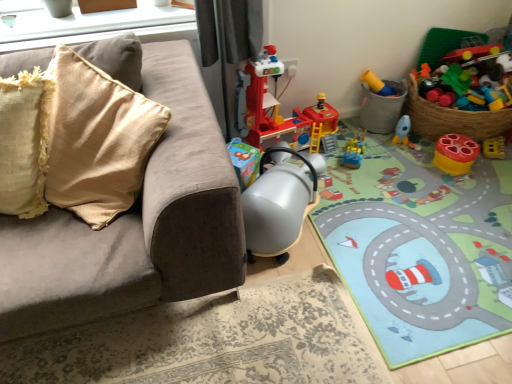
Question: Relative to matte plastic rocket at lower right, the fourth toy positioned from the left, is matte beige couch at left in front or behind?

Choices:
 (A) front
 (B) behind

Answer: (A)

Question: From a real-world perspective, is matte beige couch at left above or below matte plastic rocket at lower right, which appears as the 3th toy when viewed from the right?

Choices:
 (A) above
 (B) below

Answer: (A)

Question: Estimate the real-world distances between objects in this image. Which object is farther from the matte beige couch at left?

Choices:
 (A) translucent plastic toy at upper right, which is the 1th toy from right to left
 (B) matte plastic rocket at lower right, which appears as the 3th toy when viewed from the right
 (C) matte plastic toy at right, the 5th toy in the left-to-right sequence
 (D) carpeted play mat at center
 (E) translucent plastic train at center, positioned as the second toy in left-to-right order

Answer: (A)

Question: Estimate the real-world distances between objects in this image. Which object is farther from the carpeted play mat at center?

Choices:
 (A) matte beige couch at left
 (B) translucent plastic train at center, positioned as the second toy in left-to-right order
 (C) plastic yellow toy at upper right, which ranks as the fourth toy in right-to-left order
 (D) matte plastic rocket at lower right, the fourth toy positioned from the left
 (E) translucent plastic toy at upper right, which is the 1th toy from right to left

Answer: (A)